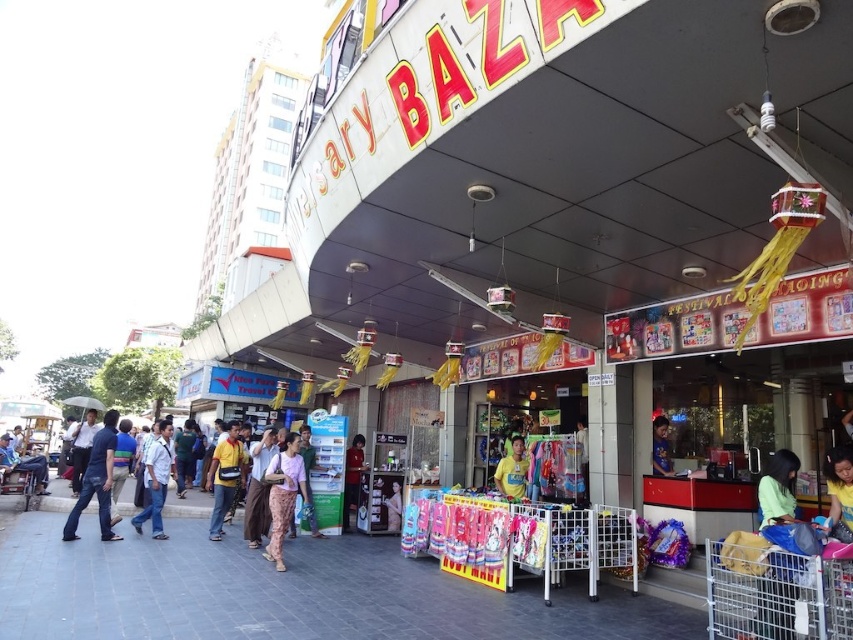
You are a customer at the market and want to buy both the blue jeans at left and the matte yellow shirt at center. Which item should you approach first if you are standing to the right of both items?

You should approach the blue jeans at left first because it is to the left of the matte yellow shirt at center, so it is closer to your current position on the right side.